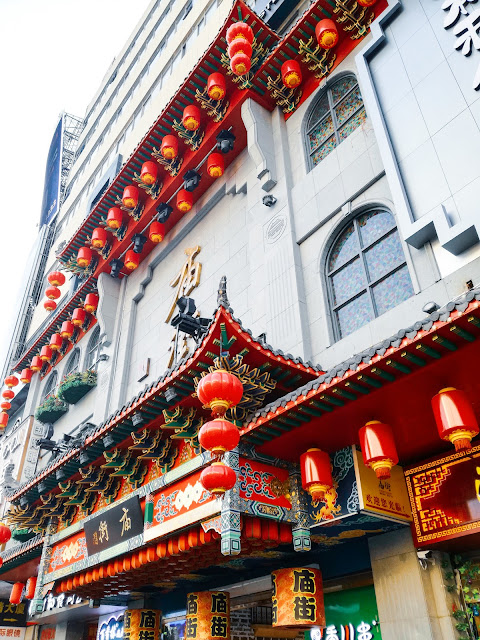
This screenshot has height=640, width=480. Identify the location of entryway lanterns. (301, 598), (196, 610), (139, 630).